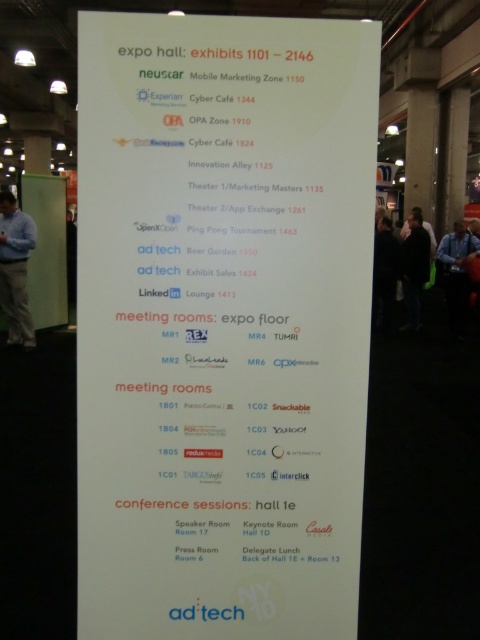
Is point (216, 577) behind point (10, 336)?

No, (216, 577) is closer to viewer.

Is white paper sign at center bigger than blue shirt at left?

No.

Is point (348, 289) closer to camera compared to point (0, 296)?

Yes, point (348, 289) is closer to viewer.

Locate an element on the screen. The height and width of the screenshot is (640, 480). white paper sign at center is located at coordinates (223, 323).